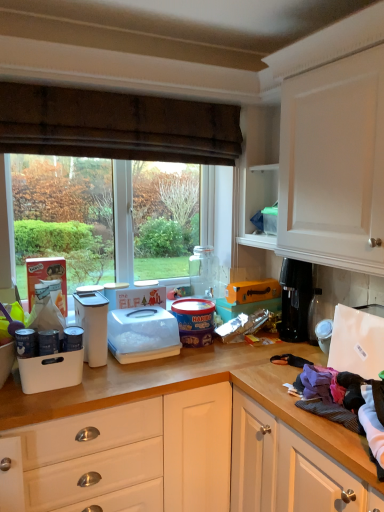
Identify the location of free point above brown textured curtain at upper center (from a real-world perspective). [139, 91].